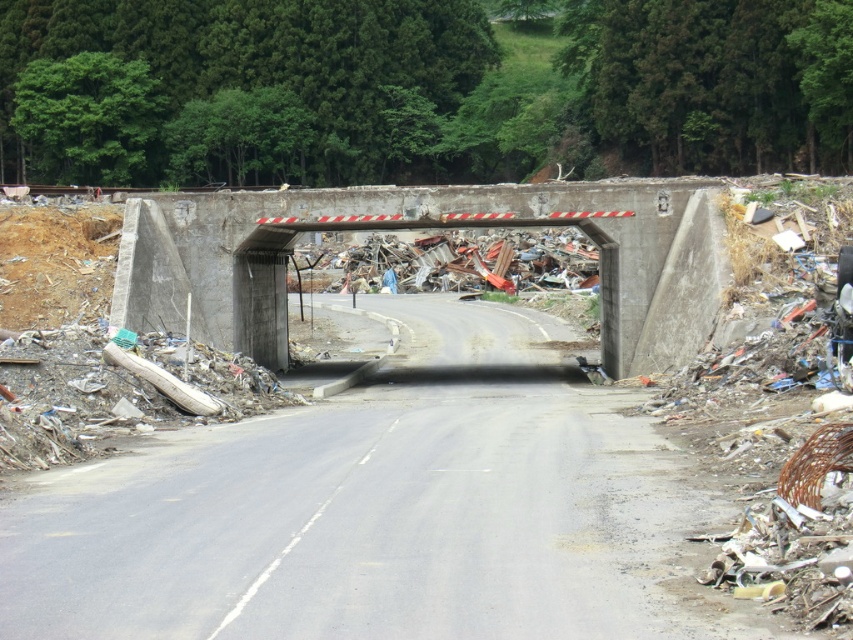
You are a delivery driver approaching the construction site. Your GPS shows your current position as coordinates 0.750, 0.400. Is the asphalt road at center ahead of you or behind you?

The asphalt road at center is located at point [363,524], which is ahead of your current position at [340,480]. Therefore, the asphalt road at center is ahead of you.

From the picture: You are a delivery driver approaching the construction site and see the asphalt road at center and the concrete bridge at center. Which object is located to the left of the other?

The asphalt road at center is positioned on the left side of concrete bridge at center, so the asphalt road at center is to the left of the concrete bridge at center.

You are driving a delivery truck that is 18 feet long. You need to pass through the gap between the asphalt road at center and the concrete bridge at center. Can your truck fit through the gap? Please explain your answer.

The gap between the asphalt road at center and the concrete bridge at center is 20.62 feet. Since your truck is 18 feet long, it can fit through the gap as it is shorter than the available space.